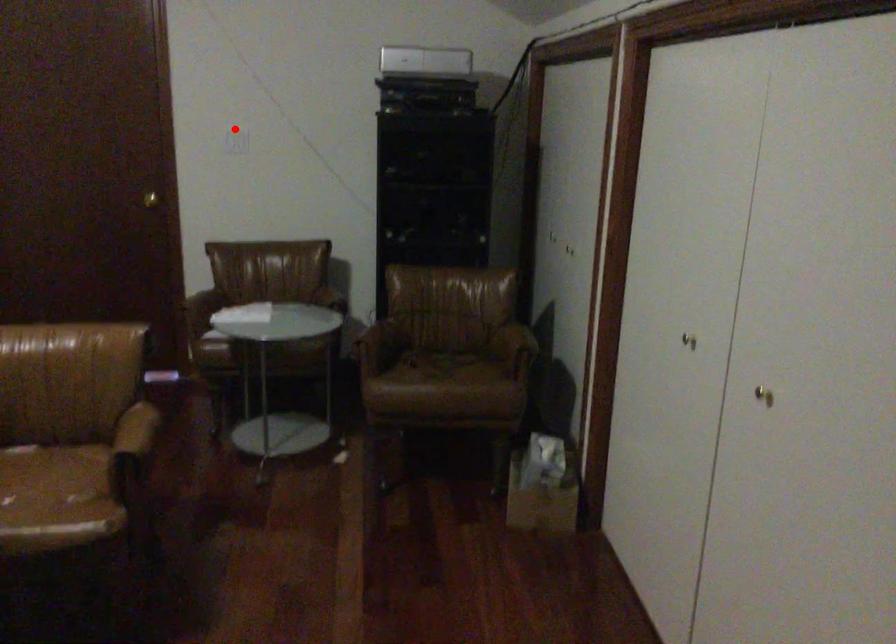
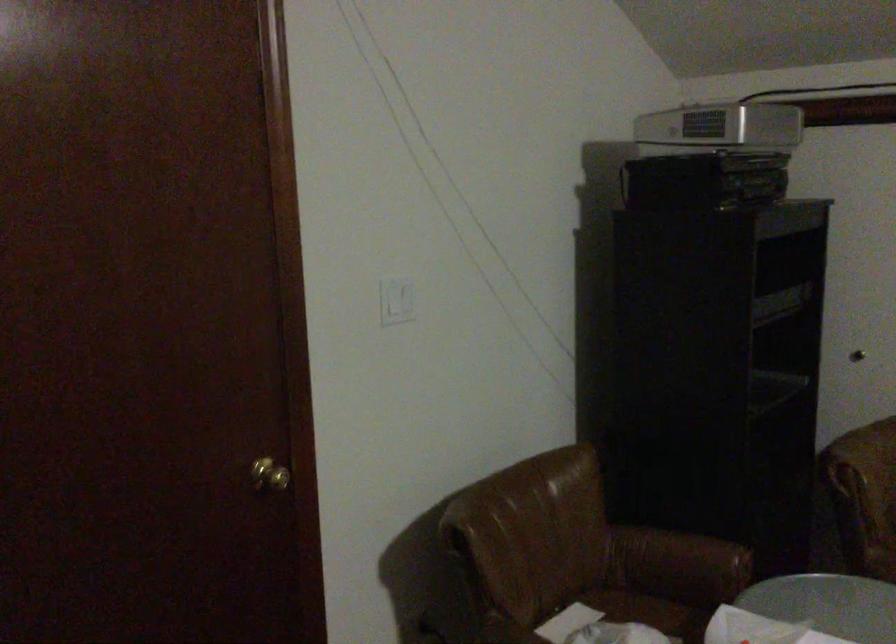
Where in the second image is the point corresponding to the highlighted location from the first image?

(397, 301)